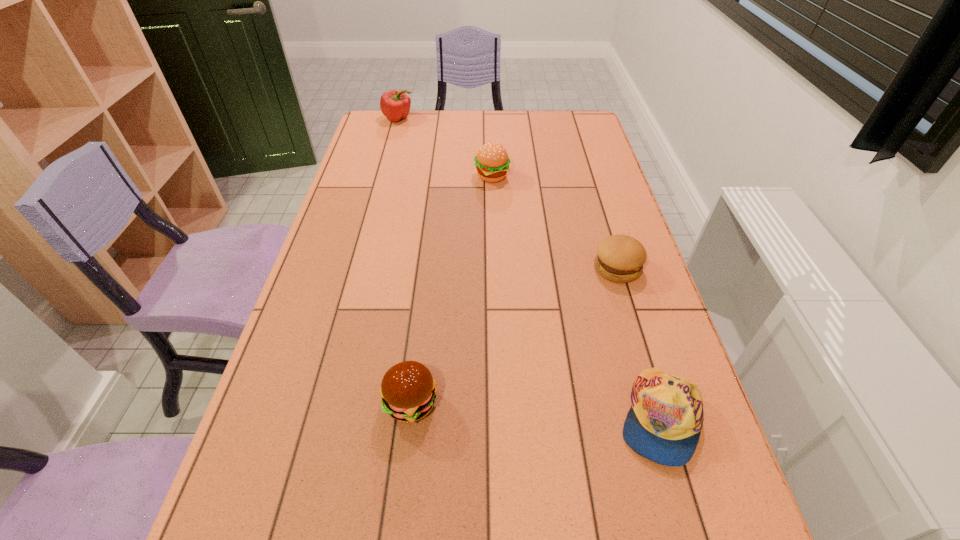
Identify the location of free space at the right edge of the desktop. The width and height of the screenshot is (960, 540). pyautogui.click(x=580, y=219).

Identify the location of blank area at the far right corner. (573, 112).

At what (x,y) coordinates should I click in order to perform the action: click on vacant space that's between the fourth object from right to left and the bell pepper. Please return your answer as a coordinate pair (x, y). Looking at the image, I should click on (404, 261).

At what (x,y) coordinates should I click in order to perform the action: click on vacant area that lies between the leftmost hamburger and the shortest hamburger. Please return your answer as a coordinate pair (x, y). This screenshot has width=960, height=540. Looking at the image, I should click on (514, 335).

Find the location of a particular element. This screenshot has width=960, height=540. vacant area that lies between the second object from left to right and the third object from right to left is located at coordinates (451, 289).

Identify the location of blank region between the farthest object and the shortest hamburger. (508, 193).

In order to click on vacant area between the second hamburger from left to right and the nearest hamburger in this screenshot , I will do `click(451, 289)`.

You are a GUI agent. You are given a task and a screenshot of the screen. Output one action in this format:
    pyautogui.click(x=<x>, y=<y>)
    Task: Click on the empty space that is in between the farthest object and the second object from left to right
    
    Given the screenshot: What is the action you would take?
    pyautogui.click(x=404, y=261)

Image resolution: width=960 pixels, height=540 pixels. What are the coordinates of `vacant area that lies between the rightmost hamburger and the cap` in the screenshot? It's located at (637, 343).

Locate an element on the screen. The image size is (960, 540). empty space that is in between the nearest hamburger and the leftmost object is located at coordinates (404, 261).